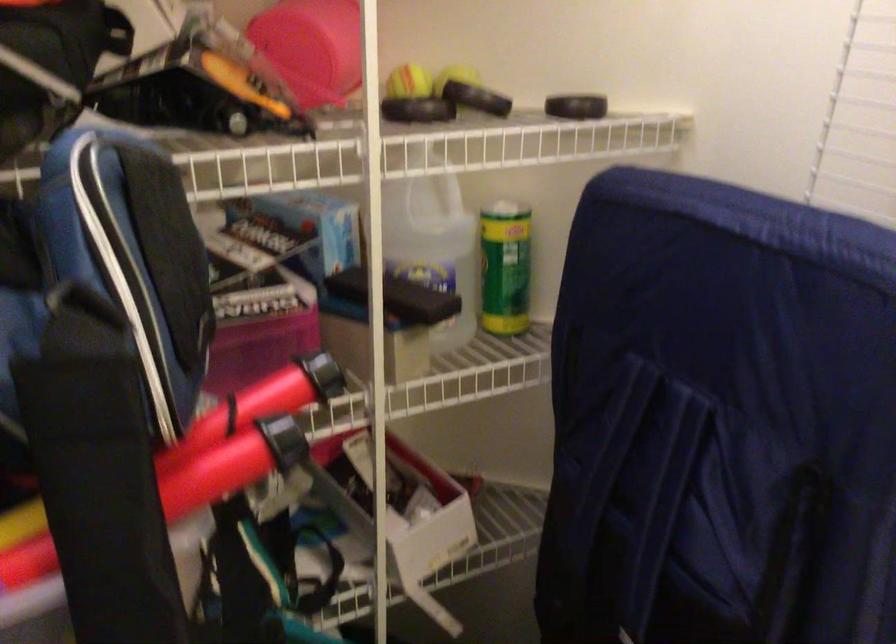
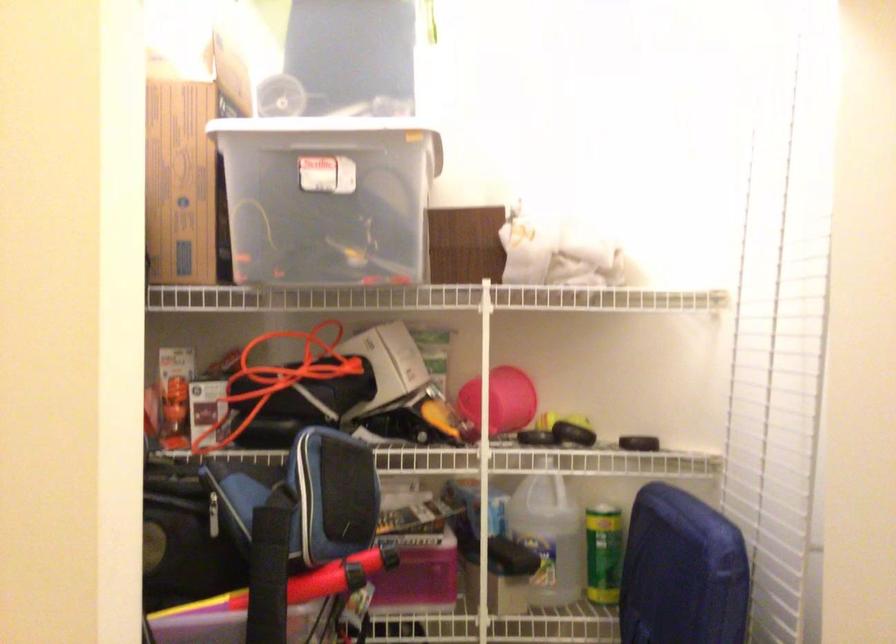
The point at (256, 348) is marked in the first image. Where is the corresponding point in the second image?

(418, 574)